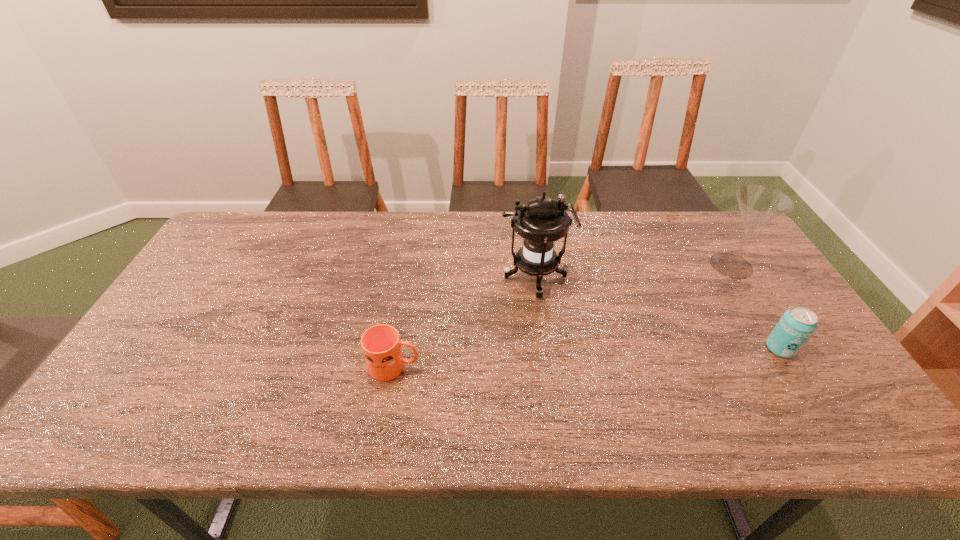
Where is `the tallest object`? the tallest object is located at coordinates (542, 221).

The image size is (960, 540). In order to click on lantern in this screenshot , I will do `click(542, 221)`.

Locate an element on the screen. The height and width of the screenshot is (540, 960). flute glass is located at coordinates (759, 205).

The image size is (960, 540). What are the coordinates of `beer can` in the screenshot? It's located at (796, 326).

The width and height of the screenshot is (960, 540). Find the location of `the leftmost object`. the leftmost object is located at coordinates (381, 345).

This screenshot has height=540, width=960. In order to click on vacant space located on the front of the third object from right to left in this screenshot , I will do `click(552, 409)`.

The height and width of the screenshot is (540, 960). I want to click on vacant space located on the left of the flute glass, so click(640, 266).

You are a GUI agent. You are given a task and a screenshot of the screen. Output one action in this format:
    pyautogui.click(x=<x>, y=<y>)
    Task: Click on the vacant area situated on the left of the beer can
    
    Given the screenshot: What is the action you would take?
    pyautogui.click(x=619, y=348)

This screenshot has width=960, height=540. In order to click on free region located 0.290m on the handle side of the mug in this screenshot , I will do `click(538, 367)`.

Locate an element on the screen. The width and height of the screenshot is (960, 540). object present at the far edge is located at coordinates (759, 205).